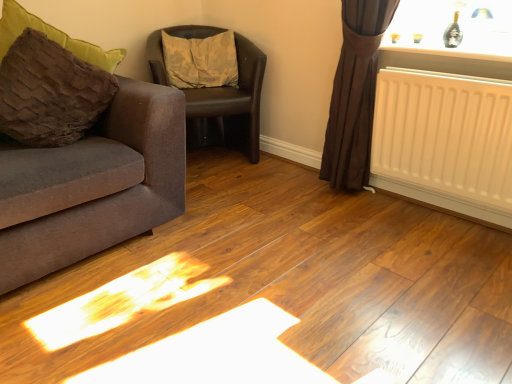
Measure the distance between white matte radiator at right and camera.

white matte radiator at right and camera are 5.37 feet apart.

What do you see at coordinates (230, 105) in the screenshot?
I see `brown leather chair at center` at bounding box center [230, 105].

Identify the location of brown leather chair at center. (230, 105).

This screenshot has height=384, width=512. Describe the element at coordinates (92, 185) in the screenshot. I see `matte gray couch at left` at that location.

How much space does camouflage fabric pillow at center, which is the first pillow from right to left, occupy horizontally?

camouflage fabric pillow at center, which is the first pillow from right to left, is 10.41 inches in width.

I want to click on white plastic radiator at upper right, so click(x=451, y=56).

Is matte gray couch at left facing away from white plastic radiator at upper right?

No, matte gray couch at left is not facing away from white plastic radiator at upper right.

Is matte gray couch at left bigger than white plastic radiator at upper right?

Yes, matte gray couch at left is bigger than white plastic radiator at upper right.

Do you think matte gray couch at left is within white plastic radiator at upper right, or outside of it?

matte gray couch at left exists outside the volume of white plastic radiator at upper right.

Locate an element on the screen. The height and width of the screenshot is (384, 512). studio couch to the left of white plastic radiator at upper right is located at coordinates (92, 185).

Image resolution: width=512 pixels, height=384 pixels. What are the coordinates of `chair above the white matte radiator at right (from the image's perspective)` in the screenshot? It's located at (230, 105).

From a real-world perspective, which object stands above the other?

brown leather chair at center.

Considering the sizes of objects white matte radiator at right and brown leather chair at center in the image provided, who is taller, white matte radiator at right or brown leather chair at center?

With more height is brown leather chair at center.

Which is more to the left, white matte radiator at right or brown leather chair at center?

From the viewer's perspective, brown leather chair at center appears more on the left side.

From the image's perspective, between white plastic radiator at upper right and camouflage fabric pillow at center, the first pillow positioned from the back, who is located below?

From the image's view, white plastic radiator at upper right is below.

Is white plastic radiator at upper right oriented away from camouflage fabric pillow at center, which is the first pillow from right to left?

No, camouflage fabric pillow at center, which is the first pillow from right to left, is not at the back of white plastic radiator at upper right.

Is white plastic radiator at upper right located outside camouflage fabric pillow at center, positioned as the 2th pillow in left-to-right order?

white plastic radiator at upper right is positioned outside camouflage fabric pillow at center, positioned as the 2th pillow in left-to-right order.

This screenshot has height=384, width=512. In order to click on window sill above the camouflage fabric pillow at center, which is the first pillow from right to left (from a real-world perspective) in this screenshot , I will do `click(451, 56)`.

From the image's perspective, which one is positioned higher, matte gray couch at left or brown leather chair at center?

brown leather chair at center appears higher in the image.

Is the depth of matte gray couch at left less than that of brown leather chair at center?

Yes.

Image resolution: width=512 pixels, height=384 pixels. Find the location of `chair that appears below the matte gray couch at left (from a real-world perspective)`. chair that appears below the matte gray couch at left (from a real-world perspective) is located at coordinates (230, 105).

Is point (0, 255) behind point (170, 63)?

No, (0, 255) is in front of (170, 63).

Based on the photo, is matte gray couch at left wider or thinner than camouflage fabric pillow at center, which is the first pillow from right to left?

In the image, matte gray couch at left appears to be wider than camouflage fabric pillow at center, which is the first pillow from right to left.

Would you say matte gray couch at left is to the left or to the right of camouflage fabric pillow at center, the 2th pillow viewed from the front, in the picture?

matte gray couch at left is to the left of camouflage fabric pillow at center, the 2th pillow viewed from the front.

Locate an element on the screen. studio couch below the camouflage fabric pillow at center, positioned as the 2th pillow in left-to-right order (from a real-world perspective) is located at coordinates (92, 185).

You are a GUI agent. You are given a task and a screenshot of the screen. Output one action in this format:
    pyautogui.click(x=<x>, y=<y>)
    Task: Click on the pillow that is behind the white plastic radiator at upper right
    
    Given the screenshot: What is the action you would take?
    pyautogui.click(x=201, y=60)

Can you confirm if camouflage fabric pillow at center, the first pillow positioned from the back, is smaller than white plastic radiator at upper right?

No, camouflage fabric pillow at center, the first pillow positioned from the back, is not smaller than white plastic radiator at upper right.

Which of these two, camouflage fabric pillow at center, the first pillow positioned from the back, or white plastic radiator at upper right, is thinner?

white plastic radiator at upper right is thinner.

Which object is positioned more to the right, white plastic radiator at upper right or matte gray couch at left?

white plastic radiator at upper right is more to the right.

Is white plastic radiator at upper right completely or partially outside of matte gray couch at left?

That's correct, white plastic radiator at upper right is outside of matte gray couch at left.

Is white plastic radiator at upper right placed right next to matte gray couch at left?

No, white plastic radiator at upper right is not with matte gray couch at left.

Image resolution: width=512 pixels, height=384 pixels. I want to click on studio couch located underneath the white plastic radiator at upper right (from a real-world perspective), so click(x=92, y=185).

The width and height of the screenshot is (512, 384). What are the coordinates of `radiator in front of the brown leather chair at center` in the screenshot? It's located at (445, 141).

Considering their positions, is brown fuzzy pillow at left, the first pillow in the left-to-right sequence, positioned closer to matte gray couch at left than brown leather chair at center?

Among the two, brown fuzzy pillow at left, the first pillow in the left-to-right sequence, is located nearer to matte gray couch at left.

When comparing their distances from white plastic radiator at upper right, does brown leather chair at center or camouflage fabric pillow at center, which is the first pillow from right to left, seem further?

camouflage fabric pillow at center, which is the first pillow from right to left, lies further to white plastic radiator at upper right than the other object.

From the image, which object appears to be farther from camouflage fabric pillow at center, positioned as the 2th pillow in left-to-right order, brown fuzzy pillow at left, the first pillow in the left-to-right sequence, or matte gray couch at left?

matte gray couch at left is positioned further to the anchor camouflage fabric pillow at center, positioned as the 2th pillow in left-to-right order.

Estimate the real-world distances between objects in this image. Which object is further from white matte radiator at right, matte gray couch at left or brown fuzzy pillow at left, the first pillow in the left-to-right sequence?

brown fuzzy pillow at left, the first pillow in the left-to-right sequence, is positioned further to the anchor white matte radiator at right.

When comparing their distances from white matte radiator at right, does matte gray couch at left or white plastic radiator at upper right seem further?

matte gray couch at left is positioned further to the anchor white matte radiator at right.

Considering their positions, is brown leather chair at center positioned further to matte gray couch at left than white plastic radiator at upper right?

Based on the image, white plastic radiator at upper right appears to be further to matte gray couch at left.

Considering their positions, is white plastic radiator at upper right positioned closer to white matte radiator at right than brown leather chair at center?

white plastic radiator at upper right lies closer to white matte radiator at right than the other object.

When comparing their distances from brown fuzzy pillow at left, which ranks as the second pillow in right-to-left order, does camouflage fabric pillow at center, the 2th pillow viewed from the front, or white matte radiator at right seem further?

Based on the image, white matte radiator at right appears to be further to brown fuzzy pillow at left, which ranks as the second pillow in right-to-left order.

You are a GUI agent. You are given a task and a screenshot of the screen. Output one action in this format:
    pyautogui.click(x=<x>, y=<y>)
    Task: Click on the radiator between brown fuzzy pillow at left, which ranks as the second pillow in right-to-left order, and white plastic radiator at upper right from left to right
    
    Given the screenshot: What is the action you would take?
    pyautogui.click(x=445, y=141)

This screenshot has width=512, height=384. I want to click on chair between camouflage fabric pillow at center, the 2th pillow viewed from the front, and white matte radiator at right, in the horizontal direction, so click(230, 105).

This screenshot has height=384, width=512. In order to click on chair located between camouflage fabric pillow at center, the 2th pillow viewed from the front, and white plastic radiator at upper right in the left-right direction in this screenshot , I will do (230, 105).

This screenshot has height=384, width=512. Identify the location of chair between brown fuzzy pillow at left, marked as the 2th pillow in a back-to-front arrangement, and white plastic radiator at upper right, in the horizontal direction. (230, 105).